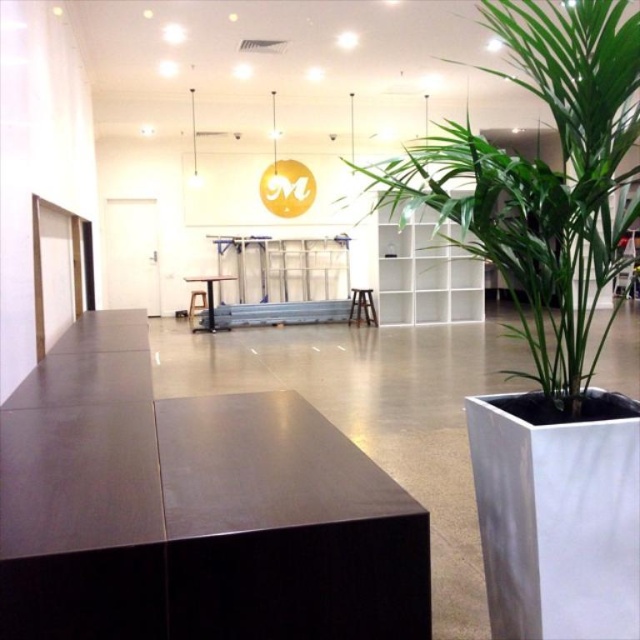
Consider the image. Can you confirm if green leafy plant at right is bigger than matte black table at center?

Yes.

Does point (460, 182) lie in front of point (205, 276)?

That is False.

Does point (600, 337) come behind point (208, 326)?

No, (600, 337) is closer to viewer.

At what (x,y) coordinates should I click in order to perform the action: click on green leafy plant at right. Please return your answer as a coordinate pair (x, y). Looking at the image, I should click on (541, 180).